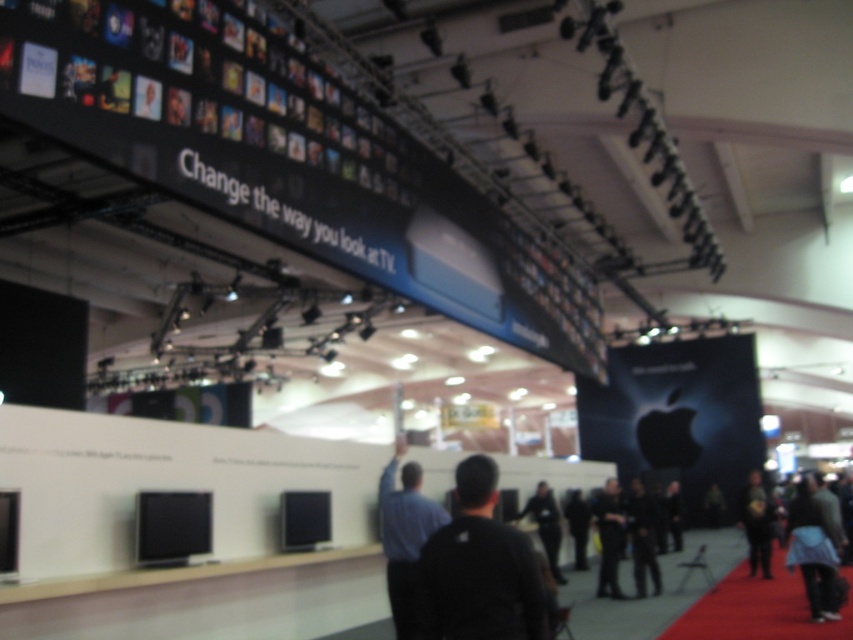
Can you confirm if dark gray fabric pants at lower right is bigger than black leather jacket at lower right?

Yes, dark gray fabric pants at lower right is bigger than black leather jacket at lower right.

The width and height of the screenshot is (853, 640). Describe the element at coordinates (608, 538) in the screenshot. I see `dark gray fabric pants at lower right` at that location.

Is point (606, 502) positioned behind point (635, 509)?

No, it is in front of (635, 509).

The width and height of the screenshot is (853, 640). Find the location of `dark gray fabric pants at lower right`. dark gray fabric pants at lower right is located at coordinates (608, 538).

Who is more forward, [442,518] or [807,512]?

Point [442,518] is in front.

Between blue shirt at center and dark gray fabric jacket at lower right, which one is positioned lower?

dark gray fabric jacket at lower right is below.

The height and width of the screenshot is (640, 853). What do you see at coordinates (404, 536) in the screenshot? I see `blue shirt at center` at bounding box center [404, 536].

I want to click on blue shirt at center, so click(404, 536).

Is blue shirt at center closer to camera compared to dark gray sweater at lower right?

Yes.

Is blue shirt at center thinner than dark gray sweater at lower right?

In fact, blue shirt at center might be wider than dark gray sweater at lower right.

Where is `blue shirt at center`? blue shirt at center is located at coordinates (404, 536).